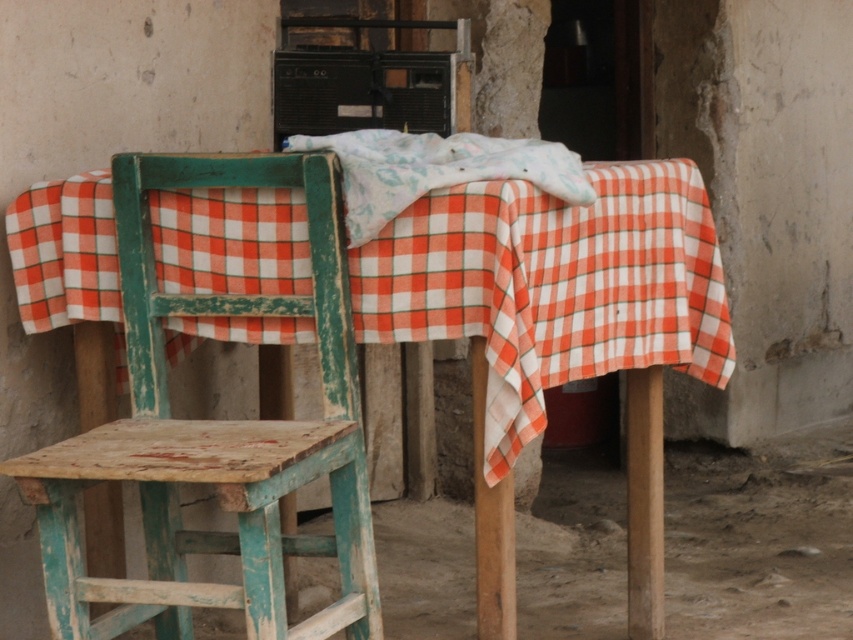
Does point (228, 237) come in front of point (345, 500)?

No, (228, 237) is behind (345, 500).

Can you confirm if checkered fabric tablecloth at center is positioned to the left of chipped teal wood stool at left?

Incorrect, checkered fabric tablecloth at center is not on the left side of chipped teal wood stool at left.

Which is behind, point (267, 328) or point (363, 534)?

The point (267, 328) is more distant.

Identify the location of checkered fabric tablecloth at center. The width and height of the screenshot is (853, 640). (553, 285).

Between point (143, 177) and point (508, 140), which one is positioned in front?

Point (143, 177) is more forward.

Does wooden chair at left appear under white cotton cloth at center?

Indeed, wooden chair at left is positioned under white cotton cloth at center.

The image size is (853, 640). What do you see at coordinates (213, 435) in the screenshot? I see `wooden chair at left` at bounding box center [213, 435].

Where is `wooden chair at left`? This screenshot has height=640, width=853. wooden chair at left is located at coordinates (213, 435).

Is point (183, 547) less distant than point (469, 172)?

No, (183, 547) is behind (469, 172).

Can you confirm if chipped teal wood stool at left is thinner than white cotton cloth at center?

No.

Locate an element on the screen. This screenshot has height=640, width=853. chipped teal wood stool at left is located at coordinates (202, 531).